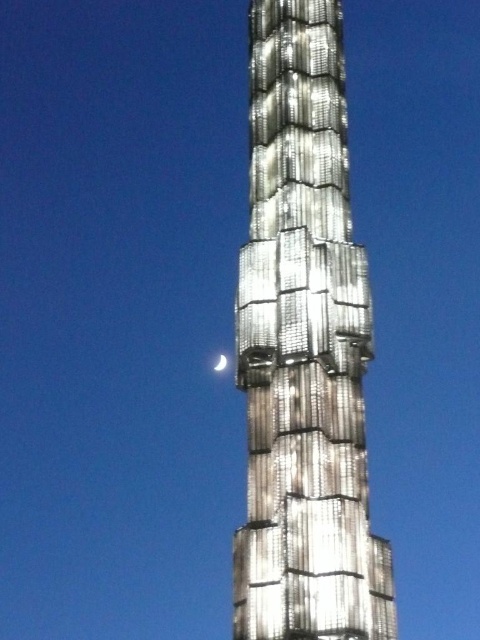
From the picture: Does metallic silver tower at center appear over silvery metallic moon at center?

Correct, metallic silver tower at center is located above silvery metallic moon at center.

What do you see at coordinates (303, 349) in the screenshot? This screenshot has width=480, height=640. I see `metallic silver tower at center` at bounding box center [303, 349].

The height and width of the screenshot is (640, 480). I want to click on metallic silver tower at center, so 303,349.